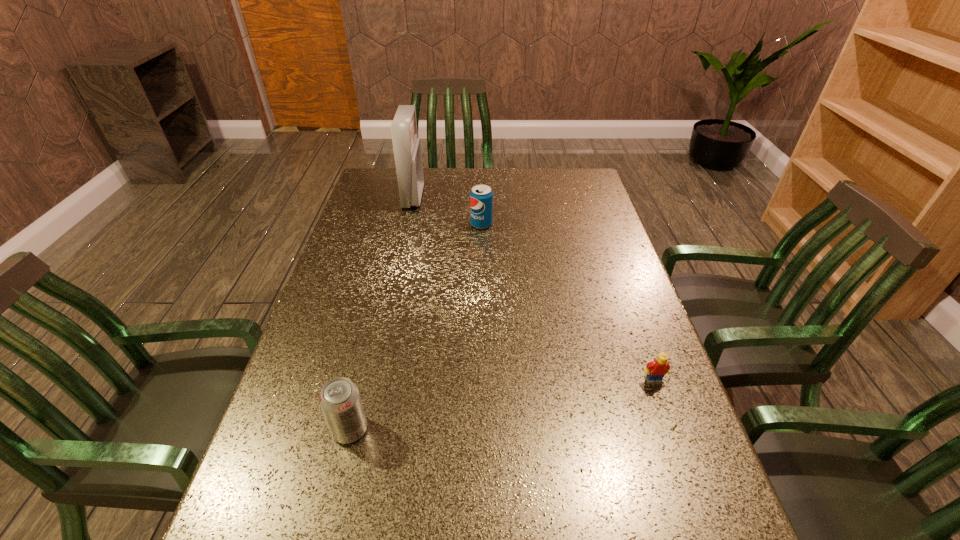
The height and width of the screenshot is (540, 960). In order to click on free space located 0.310m on the back of the nearer soda can in this screenshot , I will do `click(379, 307)`.

Where is `free region located 0.160m on the front-facing side of the Lego`? The width and height of the screenshot is (960, 540). free region located 0.160m on the front-facing side of the Lego is located at coordinates (680, 455).

This screenshot has height=540, width=960. Find the location of `object present at the far edge`. object present at the far edge is located at coordinates (406, 145).

Find the location of a particular element. the first-aid kit located in the left edge section of the desktop is located at coordinates (406, 145).

Where is `soda can that is at the left edge`? soda can that is at the left edge is located at coordinates (340, 401).

The height and width of the screenshot is (540, 960). Find the location of `object that is at the right edge`. object that is at the right edge is located at coordinates (656, 370).

Where is `object located at the far left corner`? Image resolution: width=960 pixels, height=540 pixels. object located at the far left corner is located at coordinates (406, 145).

I want to click on vacant position at the far edge of the desktop, so click(x=546, y=178).

This screenshot has height=540, width=960. In order to click on vacant area at the left edge of the desktop in this screenshot , I will do 332,492.

The width and height of the screenshot is (960, 540). In the image, there is a desktop. What are the coordinates of `vacant space at the right edge` in the screenshot? It's located at point(626,429).